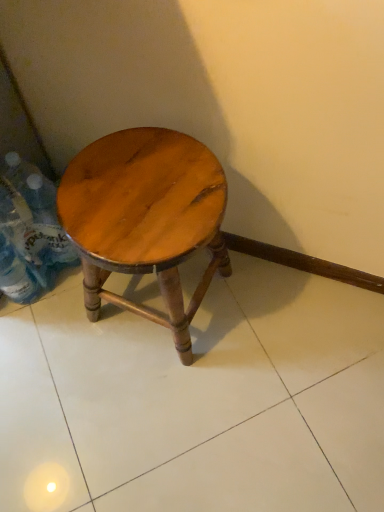
Find the location of a particular element. This screenshot has width=384, height=512. vacant area that lies in front of translucent plastic bottle at left is located at coordinates (51, 328).